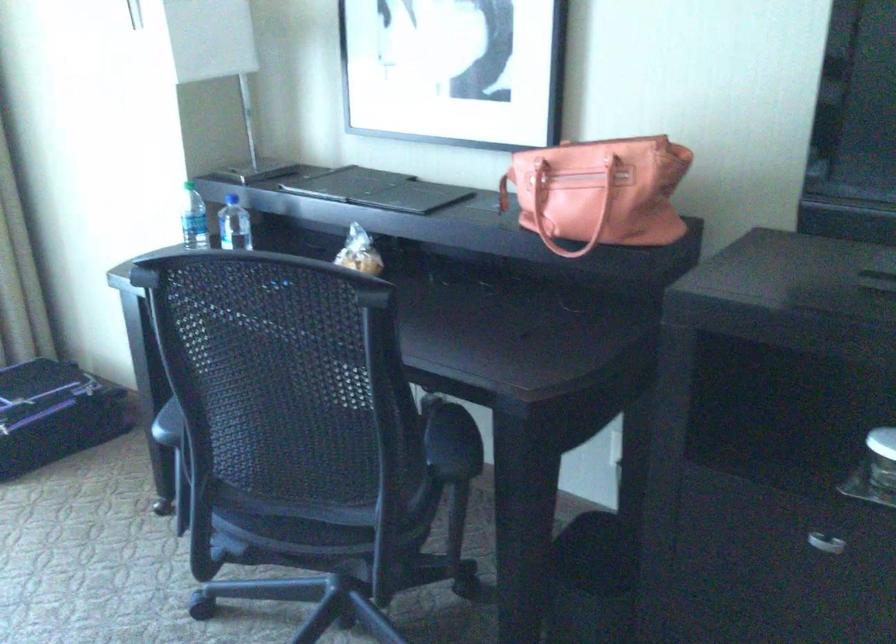
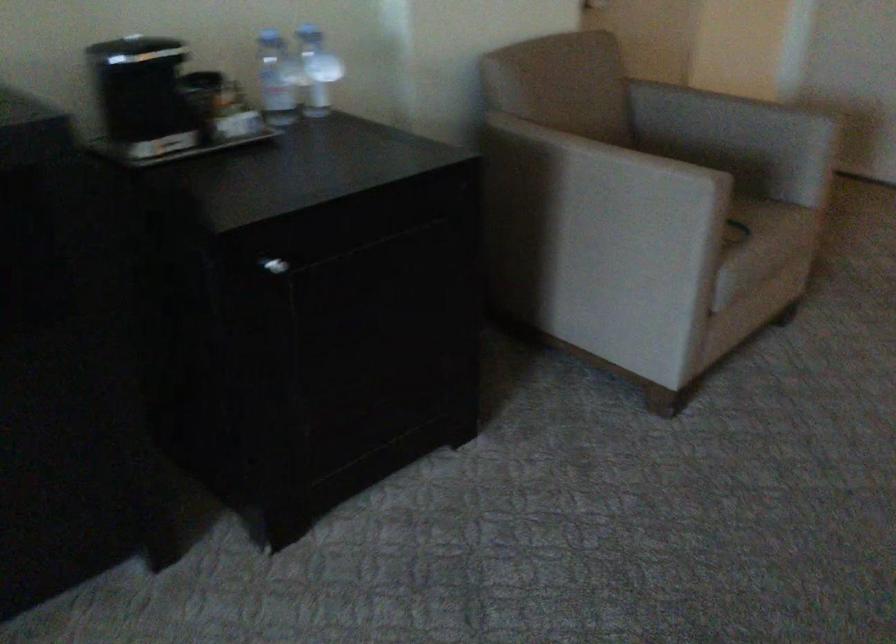
The first image is from the beginning of the video and the second image is from the end. How did the camera likely rotate when shooting the video?

The rotation direction of the camera is right-down.